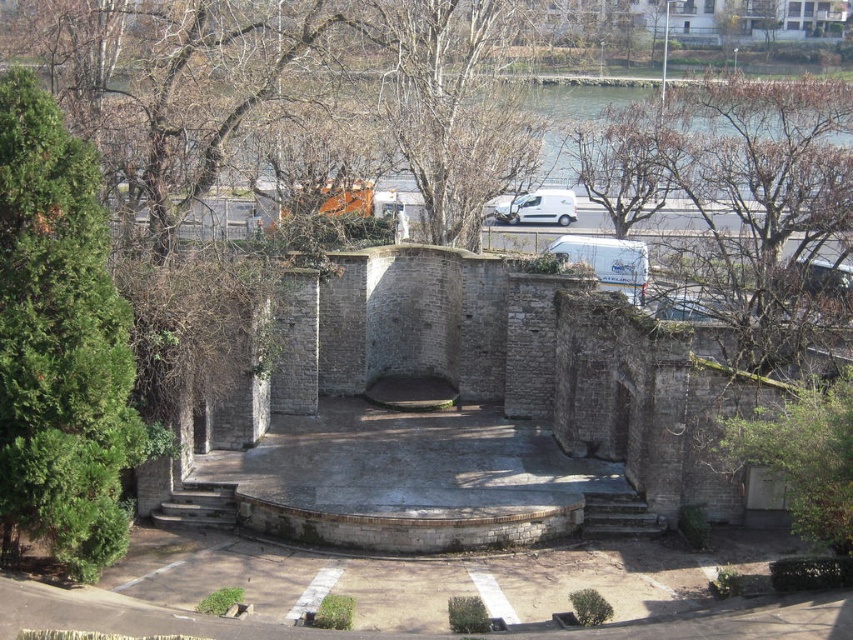
Question: Which object appears farthest from the camera in this image?

Choices:
 (A) bare wood tree at upper center
 (B) stone amphitheater at center
 (C) white matte van at center
 (D) green leafy tree at left

Answer: (C)

Question: Estimate the real-world distances between objects in this image. Which object is farther from the green leafy tree at left?

Choices:
 (A) stone amphitheater at center
 (B) bare wood tree at upper center
 (C) white matte van at center

Answer: (C)

Question: From the image, what is the correct spatial relationship of stone amphitheater at center in relation to bare wood tree at upper center?

Choices:
 (A) right
 (B) left

Answer: (A)

Question: Is bare wood tree at upper center bigger than white matte van at center?

Choices:
 (A) no
 (B) yes

Answer: (B)

Question: Is stone amphitheater at center to the left of white matte van at center from the viewer's perspective?

Choices:
 (A) yes
 (B) no

Answer: (A)

Question: Which of these objects is positioned farthest from the bare wood tree at upper center?

Choices:
 (A) stone amphitheater at center
 (B) green leafy tree at left

Answer: (B)